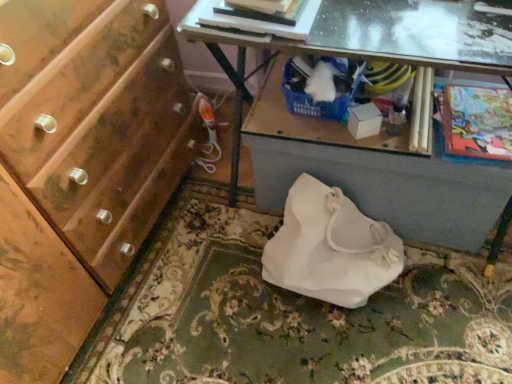
Where is `vacant area that lies in front of wooden magazine at right, marked as the first magazine in a right-to-left arrangement`? Image resolution: width=512 pixels, height=384 pixels. vacant area that lies in front of wooden magazine at right, marked as the first magazine in a right-to-left arrangement is located at coordinates (x=451, y=138).